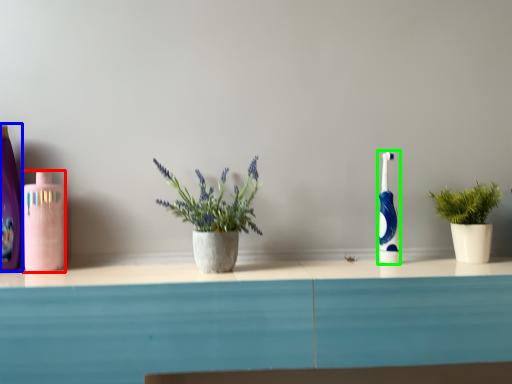
Question: Which is nearer to the mouthwash (highlighted by a red box)? cleaning product (highlighted by a blue box) or toothbrush (highlighted by a green box).

Choices:
 (A) cleaning product
 (B) toothbrush

Answer: (A)